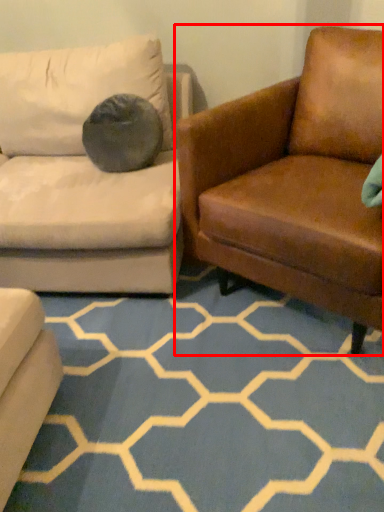
Question: Where is studio couch (annotated by the red box) located in relation to pattern in the image?

Choices:
 (A) left
 (B) right

Answer: (B)